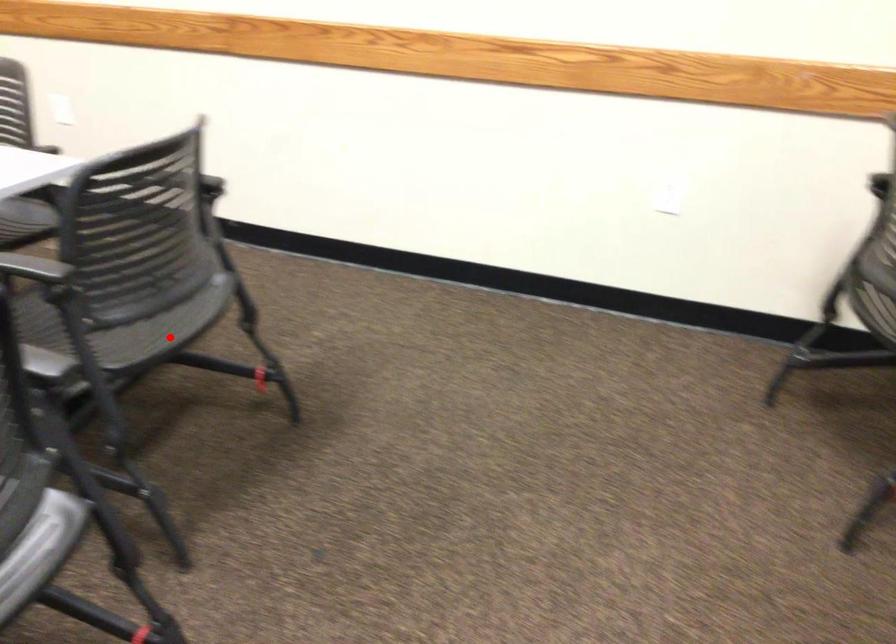
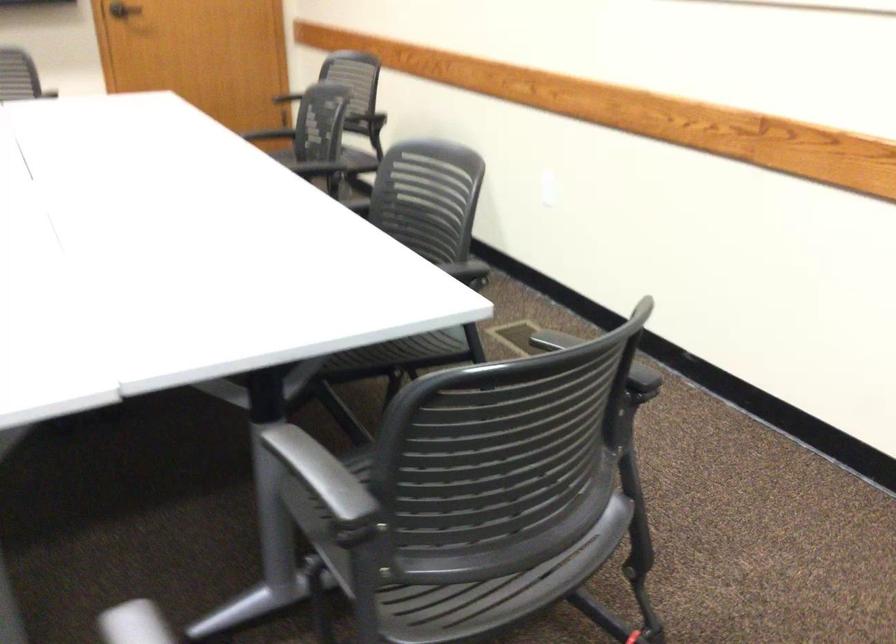
Find the pixel in the second image that matches the highlighted location in the first image.

(496, 590)